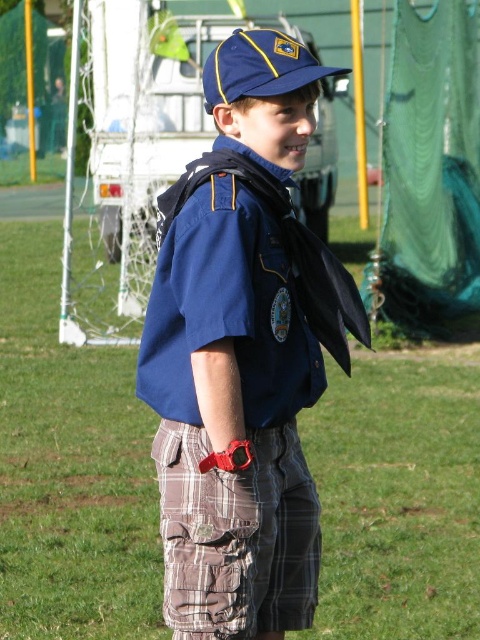
Between point (113, 465) and point (222, 93), which one is positioned in front?

Point (222, 93)

Who is higher up, green grass at center or blue fabric baseball cap at upper center?

blue fabric baseball cap at upper center is above.

Is point (48, 346) positioned in front of point (338, 68)?

No, (48, 346) is behind (338, 68).

Where is `green grass at center`? Image resolution: width=480 pixels, height=640 pixels. green grass at center is located at coordinates (70, 467).

Which of these two, blue cotton shirt at center or brown plaid shorts at center, stands taller?

blue cotton shirt at center is taller.

Between point (288, 291) and point (313, 541), which one is positioned in front?

Positioned in front is point (288, 291).

Describe the element at coordinates (242, 353) in the screenshot. The image size is (480, 640). I see `blue cotton shirt at center` at that location.

Identify the location of blue cotton shirt at center. The height and width of the screenshot is (640, 480). (242, 353).

Is blue cotton shirt at center in front of blue fabric baseball cap at upper center?

That is True.

Can you confirm if blue cotton shirt at center is positioned to the right of blue fabric baseball cap at upper center?

No, blue cotton shirt at center is not to the right of blue fabric baseball cap at upper center.

I want to click on blue cotton shirt at center, so click(x=242, y=353).